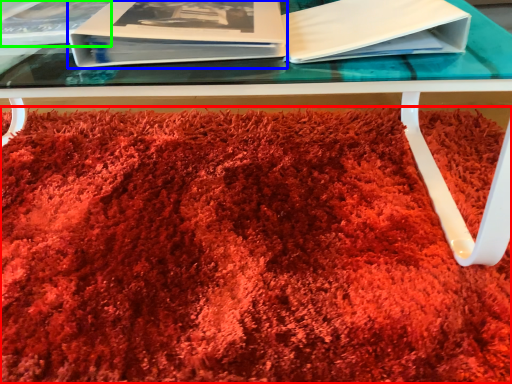
Question: Based on their relative distances, which object is nearer to blanket (highlighted by a red box)? Choose from paperback book (highlighted by a blue box) and album (highlighted by a green box).

Choices:
 (A) paperback book
 (B) album

Answer: (A)